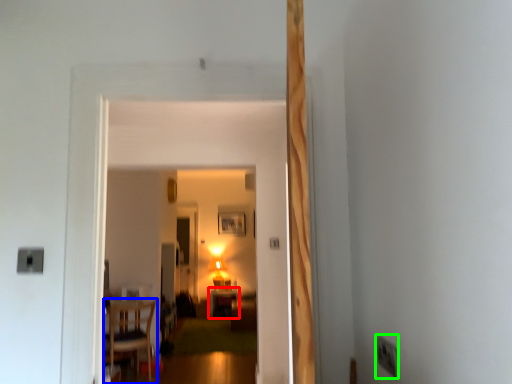
Question: Which object is the farthest from table (highlighted by a red box)? Choose among these: chair (highlighted by a blue box) or electric outlet (highlighted by a green box).

Choices:
 (A) chair
 (B) electric outlet

Answer: (B)